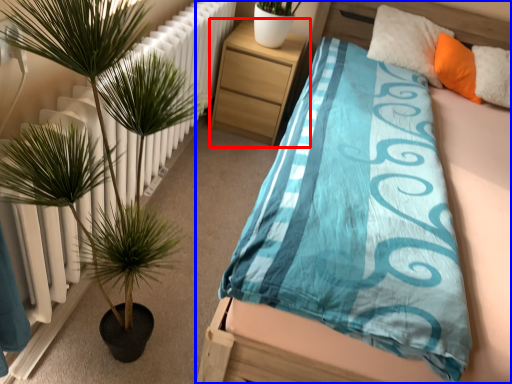
Question: Which object appears farthest to the camera in this image, nightstand (highlighted by a red box) or bed (highlighted by a blue box)?

Choices:
 (A) nightstand
 (B) bed

Answer: (A)